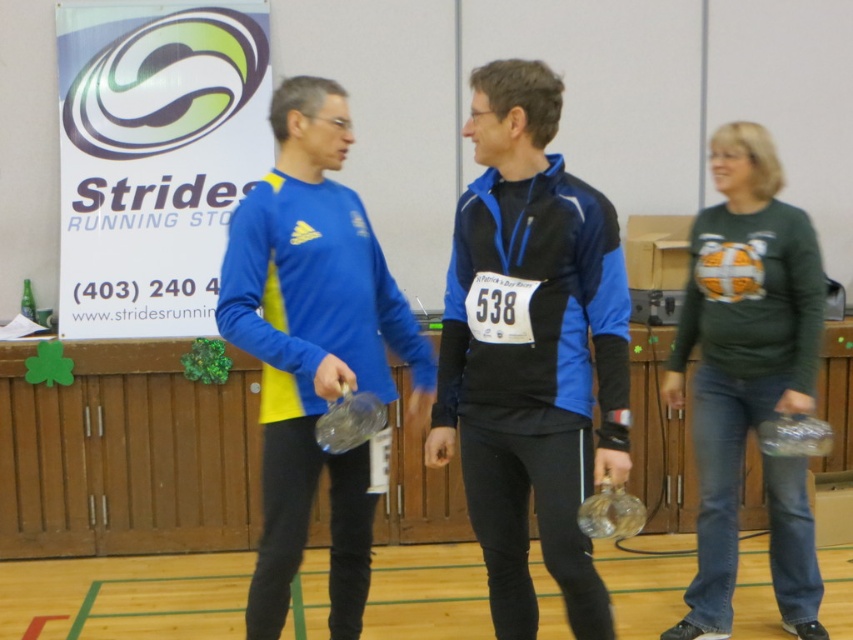
Question: From the image, what is the correct spatial relationship of blue matte long-sleeve shirt at center in relation to green jersey at right?

Choices:
 (A) left
 (B) right

Answer: (A)

Question: From the image, what is the correct spatial relationship of blue matte long-sleeve shirt at center in relation to green jersey at right?

Choices:
 (A) left
 (B) right

Answer: (A)

Question: Observing the image, what is the correct spatial positioning of blue matte jacket at center in reference to green jersey at right?

Choices:
 (A) above
 (B) below

Answer: (A)

Question: Among these points, which one is nearest to the camera?

Choices:
 (A) (305, 129)
 (B) (529, 445)
 (C) (699, 458)

Answer: (B)

Question: Which point is closer to the camera?

Choices:
 (A) blue matte long-sleeve shirt at center
 (B) green jersey at right
 (C) blue matte jacket at center

Answer: (C)

Question: Which object is farther from the camera taking this photo?

Choices:
 (A) blue matte jacket at center
 (B) blue matte long-sleeve shirt at center

Answer: (B)